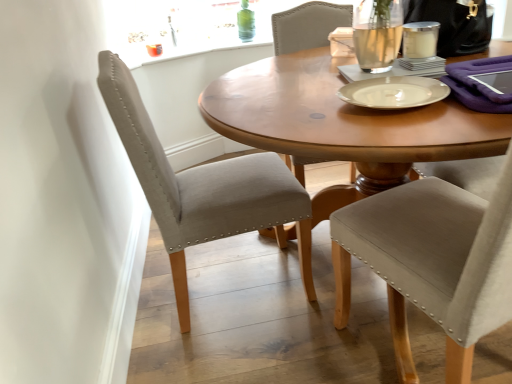
Question: Does white matte plate at center, acting as the 1th tableware starting from the front, have a smaller size compared to clear glass candle at upper right, the 1th tableware viewed from the back?

Choices:
 (A) no
 (B) yes

Answer: (A)

Question: From a real-world perspective, is white matte plate at center, which is the second tableware in back-to-front order, on top of clear glass candle at upper right, the 1th tableware viewed from the back?

Choices:
 (A) yes
 (B) no

Answer: (B)

Question: Considering the relative sizes of white matte plate at center, which is the second tableware from right to left, and clear glass candle at upper right, the 1th tableware viewed from the back, in the image provided, is white matte plate at center, which is the second tableware from right to left, thinner than clear glass candle at upper right, the 1th tableware viewed from the back,?

Choices:
 (A) no
 (B) yes

Answer: (A)

Question: Is white matte plate at center, which ranks as the 2th tableware in top-to-bottom order, outside of clear glass candle at upper right, the 1th tableware from the right?

Choices:
 (A) yes
 (B) no

Answer: (A)

Question: Can you see white matte plate at center, which ranks as the 2th tableware in top-to-bottom order, touching clear glass candle at upper right, the second tableware viewed from the front?

Choices:
 (A) yes
 (B) no

Answer: (B)

Question: Is white matte plate at center, which ranks as the 2th tableware in top-to-bottom order, at the right side of clear glass candle at upper right, the first tableware in the top-to-bottom sequence?

Choices:
 (A) no
 (B) yes

Answer: (A)

Question: Is clear glass candle at upper right, the first tableware in the top-to-bottom sequence, touching satin beige chair at left, which ranks as the 1th chair in left-to-right order?

Choices:
 (A) yes
 (B) no

Answer: (B)

Question: Is satin beige chair at left, which ranks as the 1th chair in left-to-right order, located within clear glass candle at upper right, which ranks as the 2th tableware in bottom-to-top order?

Choices:
 (A) yes
 (B) no

Answer: (B)

Question: Is the position of clear glass candle at upper right, the first tableware in the top-to-bottom sequence, more distant than that of satin beige chair at left, which ranks as the 1th chair in left-to-right order?

Choices:
 (A) no
 (B) yes

Answer: (B)

Question: Is clear glass candle at upper right, the 1th tableware viewed from the back, shorter than satin beige chair at left, which ranks as the 1th chair in left-to-right order?

Choices:
 (A) yes
 (B) no

Answer: (A)

Question: From a real-world perspective, is clear glass candle at upper right, the first tableware in the top-to-bottom sequence, on top of satin beige chair at left, the second chair viewed from the right?

Choices:
 (A) yes
 (B) no

Answer: (A)

Question: Is clear glass candle at upper right, the 1th tableware viewed from the back, positioned with its back to satin beige chair at left, the second chair viewed from the right?

Choices:
 (A) yes
 (B) no

Answer: (A)

Question: Does white matte plate at center, which ranks as the 2th tableware in top-to-bottom order, have a lesser width compared to satin beige chair at left, the second chair viewed from the right?

Choices:
 (A) no
 (B) yes

Answer: (B)